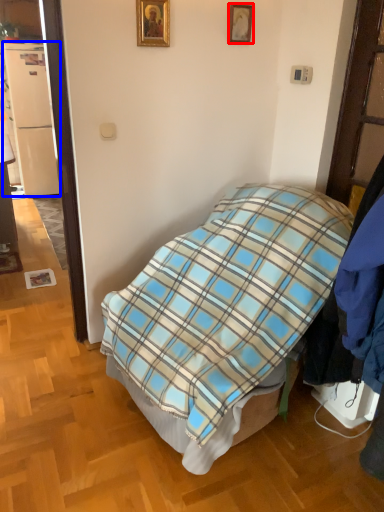
Question: Which object appears closest to the camera in this image, picture frame (highlighted by a red box) or refrigerator (highlighted by a blue box)?

Choices:
 (A) picture frame
 (B) refrigerator

Answer: (A)